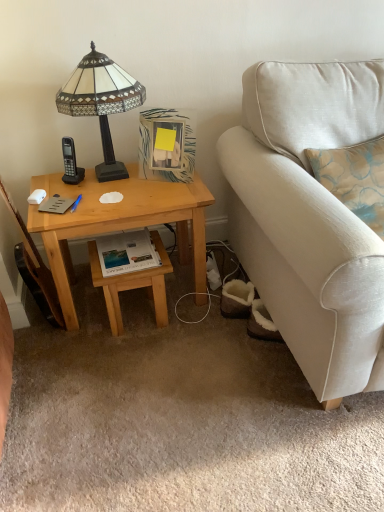
This screenshot has width=384, height=512. In order to click on vacant space to the left of light wood stool at lower center in this screenshot , I will do `click(82, 314)`.